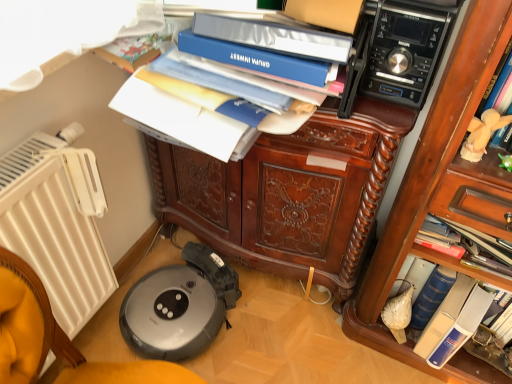
What do you see at coordinates (258, 59) in the screenshot?
I see `blue matte folder at upper center, arranged as the 1th paperback book when viewed from the top` at bounding box center [258, 59].

Locate an element on the screen. This screenshot has height=384, width=512. blue matte folder at upper center, which appears as the 2th paperback book when ordered from the bottom is located at coordinates (258, 59).

Where is `white plush toy at upper right`? This screenshot has height=384, width=512. white plush toy at upper right is located at coordinates (482, 134).

Measure the distance between black plastic stereo at upper right and camera.

They are 81.05 centimeters apart.

The image size is (512, 384). Identify the location of blue matte folder at upper center, the second paperback book viewed from the back. (258, 59).

Does blue hardcover book at lower right, the 1th paperback book in the right-to-left sequence, have a smaller size compared to black plastic stereo at upper right?

Actually, blue hardcover book at lower right, the 1th paperback book in the right-to-left sequence, might be larger than black plastic stereo at upper right.

From the image's perspective, is blue hardcover book at lower right, the 1th paperback book in the right-to-left sequence, over black plastic stereo at upper right?

No, from the image's perspective, blue hardcover book at lower right, the 1th paperback book in the right-to-left sequence, is not over black plastic stereo at upper right.

Between blue hardcover book at lower right, which ranks as the first paperback book in bottom-to-top order, and black plastic stereo at upper right, which one has less height?

black plastic stereo at upper right.

Is black plastic stereo at upper right surrounding blue matte folder at upper center?

Definitely not — blue matte folder at upper center is not inside black plastic stereo at upper right.

Can you tell me how much black plastic stereo at upper right and blue matte folder at upper center differ in facing direction?

The facing directions of black plastic stereo at upper right and blue matte folder at upper center are 8.61 degrees apart.

Which object is positioned more to the left, black plastic stereo at upper right or blue matte folder at upper center?

Positioned to the left is blue matte folder at upper center.

The height and width of the screenshot is (384, 512). Find the location of `stereo to the right of blue matte folder at upper center`. stereo to the right of blue matte folder at upper center is located at coordinates (407, 48).

From the image's perspective, is blue hardcover book at lower right located above blue matte folder at upper center?

Incorrect, from the image's perspective, blue hardcover book at lower right is lower than blue matte folder at upper center.

Is point (461, 319) closer or farther from the camera than point (218, 23)?

Point (461, 319).

In the image, is blue hardcover book at lower right positioned in front of or behind blue matte folder at upper center?

Visually, blue hardcover book at lower right is located behind blue matte folder at upper center.

Is blue hardcover book at lower right inside or outside of blue matte folder at upper center?

blue hardcover book at lower right is located beyond the bounds of blue matte folder at upper center.

Locate an element on the screen. The width and height of the screenshot is (512, 384). paperback book above the white plush toy at upper right (from a real-world perspective) is located at coordinates (x=258, y=59).

Between blue matte folder at upper center, marked as the second paperback book in a right-to-left arrangement, and white plush toy at upper right, which one appears on the left side from the viewer's perspective?

blue matte folder at upper center, marked as the second paperback book in a right-to-left arrangement, is more to the left.

Who is shorter, blue matte folder at upper center, which appears as the 2th paperback book when ordered from the bottom, or white plush toy at upper right?

With less height is blue matte folder at upper center, which appears as the 2th paperback book when ordered from the bottom.

Is blue hardcover book at lower right, which is the 2th paperback book from left to right, oriented towards blue matte folder at upper center, arranged as the 1th paperback book when viewed from the top?

No, blue hardcover book at lower right, which is the 2th paperback book from left to right, is not aimed at blue matte folder at upper center, arranged as the 1th paperback book when viewed from the top.

What's the angular difference between blue hardcover book at lower right, the 1th paperback book in the right-to-left sequence, and blue matte folder at upper center, which appears as the 2th paperback book when ordered from the bottom,'s facing directions?

The facing directions of blue hardcover book at lower right, the 1th paperback book in the right-to-left sequence, and blue matte folder at upper center, which appears as the 2th paperback book when ordered from the bottom, are 19.5 degrees apart.

Considering the relative sizes of blue hardcover book at lower right, the 1th paperback book from the back, and blue matte folder at upper center, which appears as the 2th paperback book when ordered from the bottom, in the image provided, is blue hardcover book at lower right, the 1th paperback book from the back, thinner than blue matte folder at upper center, which appears as the 2th paperback book when ordered from the bottom,?

In fact, blue hardcover book at lower right, the 1th paperback book from the back, might be wider than blue matte folder at upper center, which appears as the 2th paperback book when ordered from the bottom.

Is blue hardcover book at lower right, marked as the second paperback book in a top-to-bottom arrangement, beside blue matte folder at upper center?

No, blue hardcover book at lower right, marked as the second paperback book in a top-to-bottom arrangement, is not making contact with blue matte folder at upper center.

Measure the distance between blue hardcover book at lower right, which is the 2th paperback book from left to right, and blue matte folder at upper center.

blue hardcover book at lower right, which is the 2th paperback book from left to right, is 34.04 inches away from blue matte folder at upper center.

Which is behind, point (488, 301) or point (317, 35)?

The point (488, 301) is behind.

From a real-world perspective, which object rests below the other?

From a 3D spatial view, blue hardcover book at lower right, placed as the second paperback book when sorted from front to back, is below.

Is blue hardcover book at lower right outside of white plush toy at upper right?

blue hardcover book at lower right lies outside white plush toy at upper right's area.

Does blue hardcover book at lower right have a larger size compared to white plush toy at upper right?

Indeed, blue hardcover book at lower right has a larger size compared to white plush toy at upper right.

From the image's perspective, is blue hardcover book at lower right located above or below white plush toy at upper right?

Clearly, from the image's perspective, blue hardcover book at lower right is below white plush toy at upper right.

I want to click on the 2nd paperback book below when counting from the black plastic stereo at upper right (from the image's perspective), so click(x=461, y=326).

I want to click on bin in front of the black plastic stereo at upper right, so click(275, 37).

Based on their spatial positions, is white plush toy at upper right or brown polished wood cabinet at center further from blue hardcover book at lower right, placed as the second paperback book when sorted from front to back?

Among the two, brown polished wood cabinet at center is located further to blue hardcover book at lower right, placed as the second paperback book when sorted from front to back.

When comparing their distances from blue matte folder at upper center, does blue hardcover book at lower right, placed as the second paperback book when sorted from front to back, or brown polished wood cabinet at center seem further?

Based on the image, blue hardcover book at lower right, placed as the second paperback book when sorted from front to back, appears to be further to blue matte folder at upper center.

Looking at the image, which one is located closer to white plastic radiator at left, brown polished wood cabinet at center or blue matte folder at upper center?

brown polished wood cabinet at center.

When comparing their distances from blue hardcover book at lower right, does white plush toy at upper right or white plastic radiator at left seem further?

white plastic radiator at left lies further to blue hardcover book at lower right than the other object.

Considering their positions, is white plush toy at upper right positioned further to blue matte folder at upper center than blue hardcover book at lower right?

blue hardcover book at lower right lies further to blue matte folder at upper center than the other object.

Based on their spatial positions, is brown polished wood cabinet at center or white plastic radiator at left further from blue hardcover book at lower right?

white plastic radiator at left is positioned further to the anchor blue hardcover book at lower right.

Which object lies further to the anchor point blue matte folder at upper center, which is the first paperback book from left to right, blue hardcover book at lower right, marked as the second paperback book in a top-to-bottom arrangement, or blue matte folder at upper center?

blue hardcover book at lower right, marked as the second paperback book in a top-to-bottom arrangement, is further to blue matte folder at upper center, which is the first paperback book from left to right.

Based on their spatial positions, is white plastic radiator at left or blue matte folder at upper center further from blue hardcover book at lower right, marked as the second paperback book in a top-to-bottom arrangement?

white plastic radiator at left.

At what (x,y) coordinates should I click in order to perform the action: click on paperback book between white plastic radiator at left and black plastic stereo at upper right from left to right. Please return your answer as a coordinate pair (x, y). Looking at the image, I should click on (258, 59).

Locate an element on the screen. Image resolution: width=512 pixels, height=384 pixels. paperback book between white plastic radiator at left and white plush toy at upper right in the horizontal direction is located at coordinates (258, 59).

The height and width of the screenshot is (384, 512). What are the coordinates of `cabinetry between black plastic stereo at upper right and blue hardcover book at lower right, placed as the second paperback book when sorted from front to back, in the up-down direction` in the screenshot? It's located at (289, 193).

I want to click on bin located between blue matte folder at upper center, marked as the second paperback book in a right-to-left arrangement, and black plastic stereo at upper right in the left-right direction, so click(275, 37).